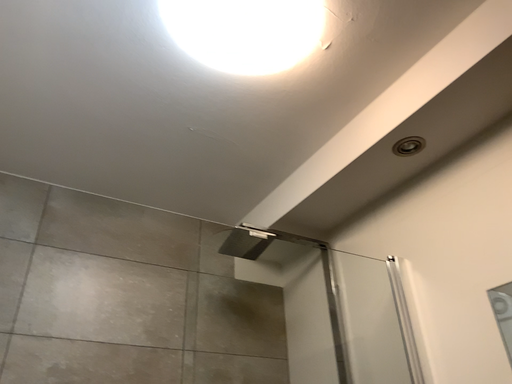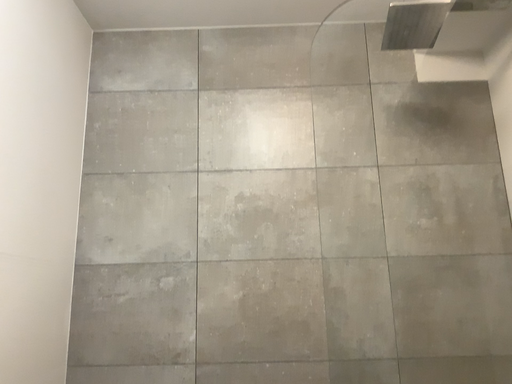
Question: Which way did the camera rotate in the video?

Choices:
 (A) rotated left
 (B) rotated right

Answer: (A)